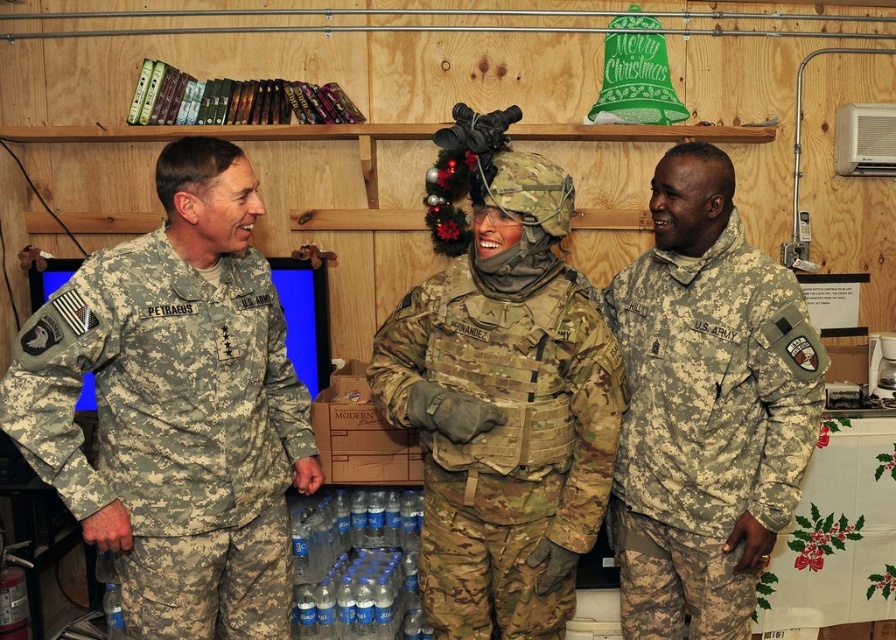
Question: Is camouflage fabric uniform at right wider than camouflage fabric uniform at center?

Choices:
 (A) no
 (B) yes

Answer: (A)

Question: Among these points, which one is nearest to the camera?

Choices:
 (A) (745, 422)
 (B) (619, 396)
 (C) (125, 396)

Answer: (C)

Question: Which object is the farthest from the camouflage fabric uniform at right?

Choices:
 (A) camouflage fabric uniform at center
 (B) camouflage fabric uniform at left

Answer: (B)

Question: Is camouflage fabric uniform at left wider than camouflage fabric uniform at center?

Choices:
 (A) yes
 (B) no

Answer: (B)

Question: Can you confirm if camouflage fabric uniform at left is thinner than camouflage fabric uniform at right?

Choices:
 (A) no
 (B) yes

Answer: (A)

Question: Which of the following is the closest to the observer?

Choices:
 (A) (645, 296)
 (B) (221, 577)

Answer: (B)